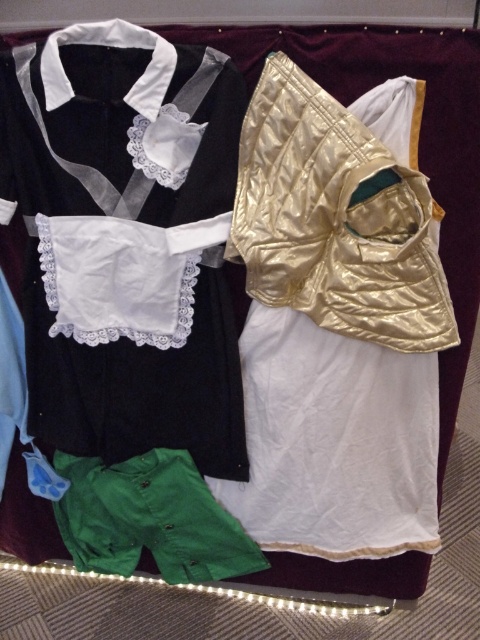
Question: From the image, what is the correct spatial relationship of black velvet shirt at upper left in relation to gold quilted dress at upper right?

Choices:
 (A) above
 (B) below

Answer: (A)

Question: Considering the real-world distances, which object is farthest from the green cotton shorts at lower left?

Choices:
 (A) black velvet shirt at upper left
 (B) gold quilted dress at upper right

Answer: (A)

Question: Among these points, which one is nearest to the camera?

Choices:
 (A) (257, 563)
 (B) (231, 339)
 (C) (253, 352)

Answer: (B)

Question: Can you confirm if gold quilted dress at upper right is bigger than green cotton shorts at lower left?

Choices:
 (A) yes
 (B) no

Answer: (A)

Question: Where is gold quilted dress at upper right located in relation to green cotton shorts at lower left in the image?

Choices:
 (A) below
 (B) above

Answer: (B)

Question: Which point is closer to the camera taking this photo?

Choices:
 (A) (217, 518)
 (B) (370, 324)

Answer: (B)